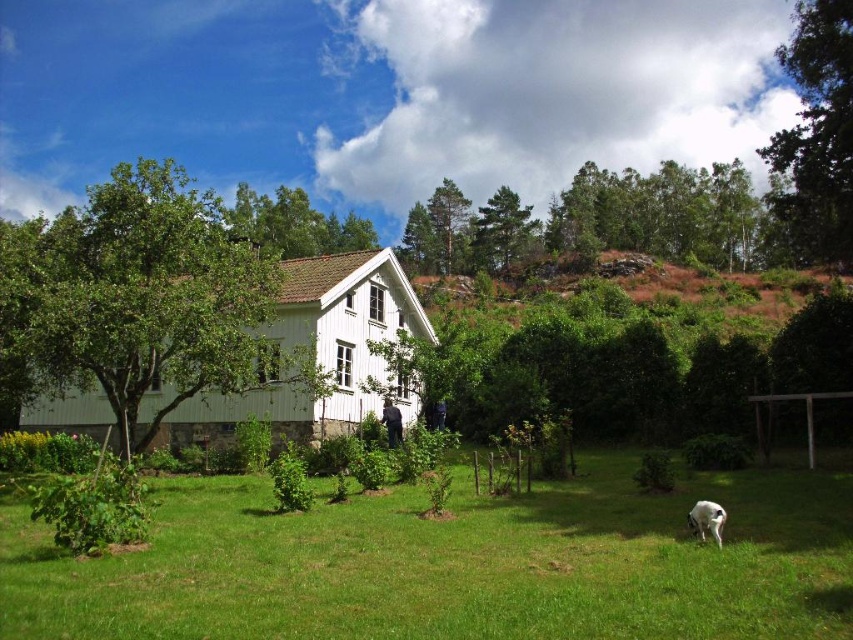
Is point (790, 554) farther from viewer compared to point (700, 522)?

No, (790, 554) is closer to viewer.

Is green grass at center in front of white fur dog at lower right?

That is True.

Is point (9, 609) in front of point (708, 522)?

Yes, point (9, 609) is closer to viewer.

The image size is (853, 640). Find the location of `green grass at center`. green grass at center is located at coordinates (454, 563).